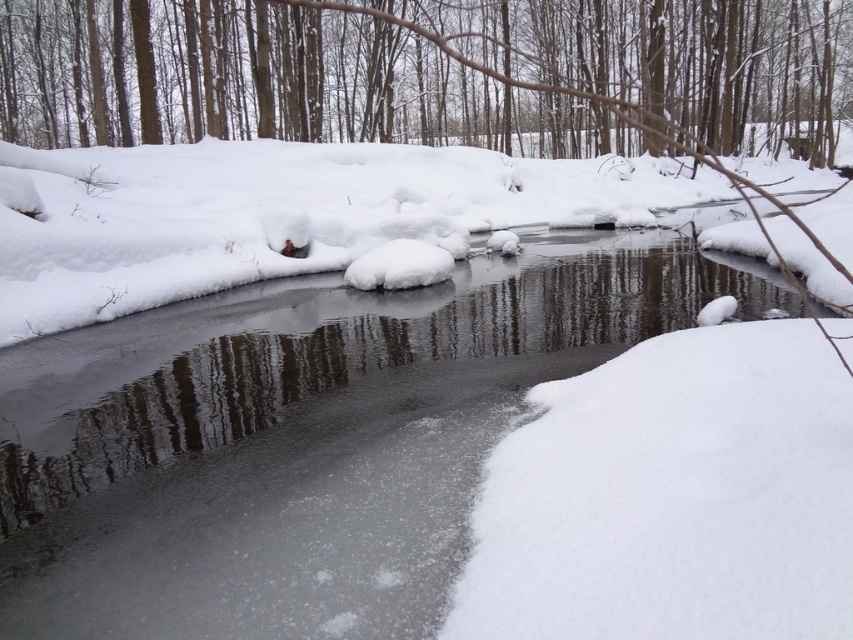
Question: Which point appears farthest from the camera in this image?

Choices:
 (A) (569, 99)
 (B) (242, 420)

Answer: (A)

Question: From the image, what is the correct spatial relationship of clear ice stream at center in relation to smooth bark tree at upper center?

Choices:
 (A) right
 (B) left

Answer: (B)

Question: Does clear ice stream at center appear on the left side of smooth bark tree at upper center?

Choices:
 (A) yes
 (B) no

Answer: (A)

Question: Which point is closer to the camera?

Choices:
 (A) smooth bark tree at upper center
 (B) clear ice stream at center

Answer: (A)

Question: Is clear ice stream at center positioned before smooth bark tree at upper center?

Choices:
 (A) yes
 (B) no

Answer: (B)